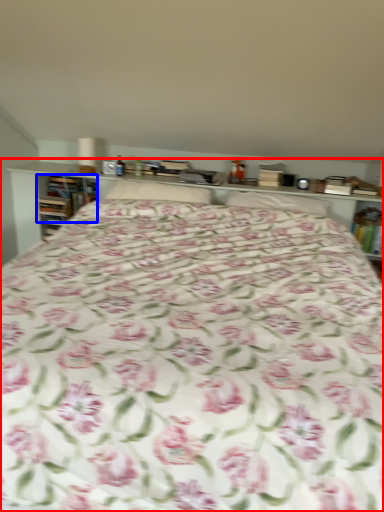
Question: Which object appears farthest to the camera in this image, bed (highlighted by a red box) or book (highlighted by a blue box)?

Choices:
 (A) bed
 (B) book

Answer: (B)